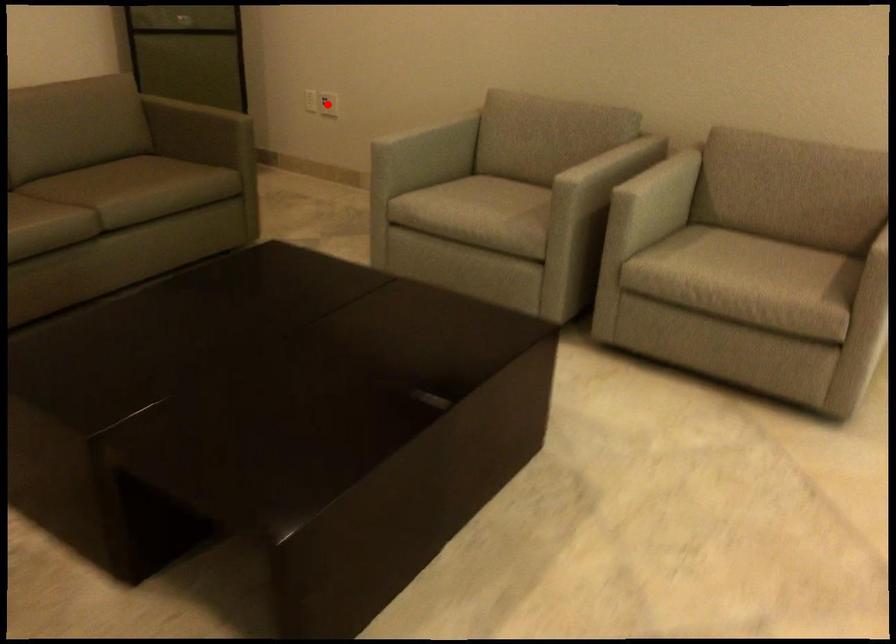
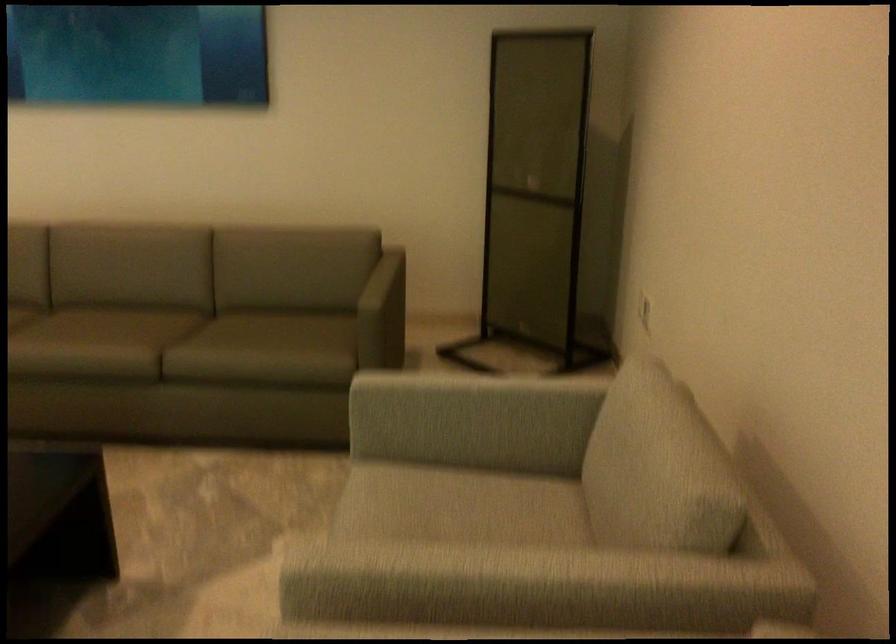
Question: I am providing you with two images of the same scene from different viewpoints. A red point is marked on the first image. Can you still see the location of the red point in image 2?

Choices:
 (A) Yes
 (B) No

Answer: (B)